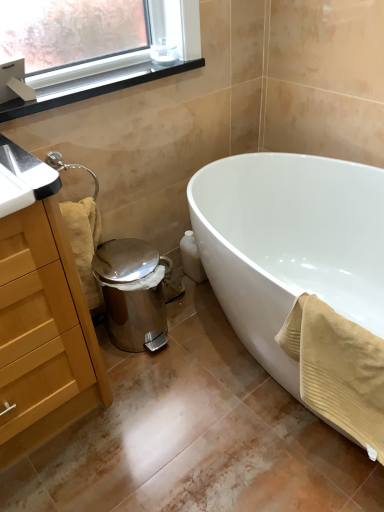
Question: Should I look upward or downward to see wooden cabinet at left?

Choices:
 (A) down
 (B) up

Answer: (A)

Question: Should I look upward or downward to see beige textured towel at lower left, the first bath towel positioned from the back?

Choices:
 (A) down
 (B) up

Answer: (B)

Question: Could beige textured towel at lower left, the first bath towel from the left, be considered to be inside black plastic window sill at upper left?

Choices:
 (A) yes
 (B) no

Answer: (B)

Question: Is black plastic window sill at upper left behind beige textured towel at lower left, which is the 2th bath towel from right to left?

Choices:
 (A) no
 (B) yes

Answer: (A)

Question: Does black plastic window sill at upper left appear on the left side of beige textured towel at lower left, which is the 2th bath towel from right to left?

Choices:
 (A) yes
 (B) no

Answer: (B)

Question: Considering the relative sizes of black plastic window sill at upper left and beige textured towel at lower left, which is the 2th bath towel from right to left, in the image provided, is black plastic window sill at upper left smaller than beige textured towel at lower left, which is the 2th bath towel from right to left,?

Choices:
 (A) yes
 (B) no

Answer: (A)

Question: Can we say black plastic window sill at upper left lies outside beige textured towel at lower left, the first bath towel from the left?

Choices:
 (A) no
 (B) yes

Answer: (B)

Question: Does black plastic window sill at upper left appear on the right side of beige textured towel at lower left, the first bath towel positioned from the back?

Choices:
 (A) no
 (B) yes

Answer: (B)

Question: Considering the relative sizes of beige textured towel at lower right, the 1th bath towel from the front, and wooden cabinet at left in the image provided, is beige textured towel at lower right, the 1th bath towel from the front, shorter than wooden cabinet at left?

Choices:
 (A) no
 (B) yes

Answer: (B)

Question: From a real-world perspective, is beige textured towel at lower right, the second bath towel in the left-to-right sequence, positioned over wooden cabinet at left based on gravity?

Choices:
 (A) no
 (B) yes

Answer: (A)

Question: Is wooden cabinet at left surrounded by beige textured towel at lower right, the 1th bath towel from the front?

Choices:
 (A) yes
 (B) no

Answer: (B)

Question: From a real-world perspective, is beige textured towel at lower right, the 1th bath towel from the front, beneath wooden cabinet at left?

Choices:
 (A) no
 (B) yes

Answer: (B)

Question: From the image's perspective, is beige textured towel at lower right, which appears as the 2th bath towel when viewed from the back, above wooden cabinet at left?

Choices:
 (A) yes
 (B) no

Answer: (B)

Question: Does beige textured towel at lower right, placed as the first bath towel when sorted from right to left, have a lesser width compared to wooden cabinet at left?

Choices:
 (A) no
 (B) yes

Answer: (B)

Question: Are beige textured towel at lower left, the first bath towel from the left, and white glossy bathtub at lower right far apart?

Choices:
 (A) no
 (B) yes

Answer: (A)